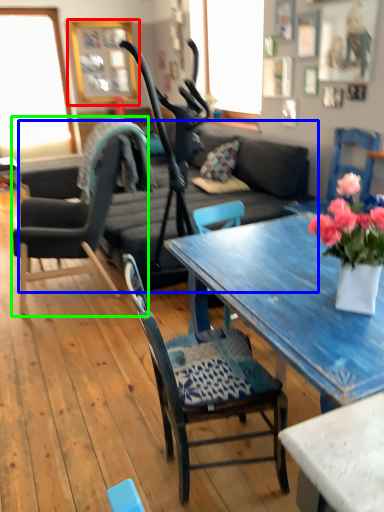
Question: Which is farther away from picture frame (highlighted by a red box)? studio couch (highlighted by a blue box) or chair (highlighted by a green box)?

Choices:
 (A) studio couch
 (B) chair

Answer: (B)